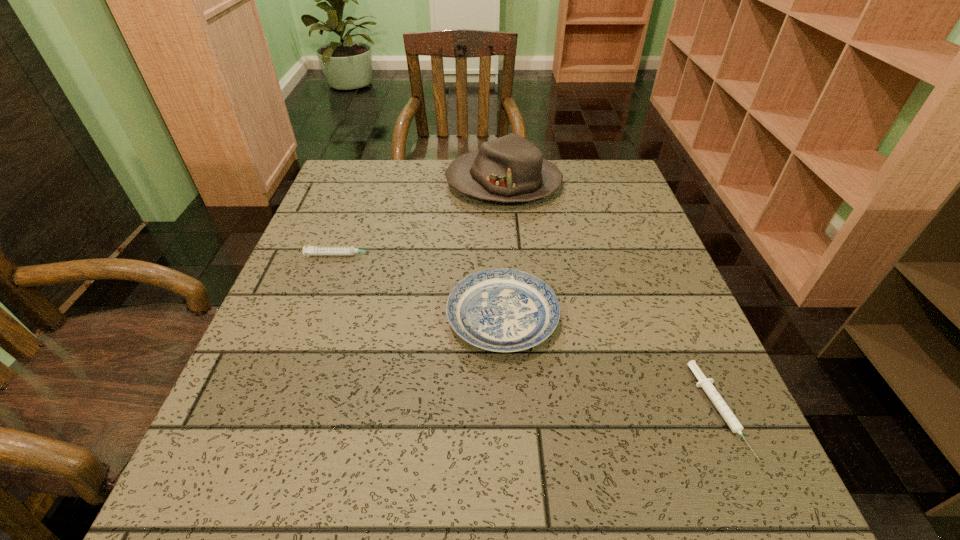
Locate an element on the screen. The image size is (960, 540). the tallest object is located at coordinates (511, 168).

Find the location of `the farthest object`. the farthest object is located at coordinates (511, 168).

Find the location of a particular element. plate is located at coordinates (503, 310).

Locate an element on the screen. The height and width of the screenshot is (540, 960). the third shortest object is located at coordinates (503, 310).

This screenshot has width=960, height=540. Find the location of `the third tallest object`. the third tallest object is located at coordinates [x=309, y=250].

In order to click on the left syringe in this screenshot , I will do `click(309, 250)`.

Where is `the shortest object`? This screenshot has width=960, height=540. the shortest object is located at coordinates (706, 384).

In order to click on the shorter syringe in this screenshot , I will do `click(706, 384)`.

The height and width of the screenshot is (540, 960). What are the coordinates of `free spot located on the decorative side of the hat` in the screenshot? It's located at (417, 184).

Locate an element on the screen. This screenshot has height=540, width=960. vacant space situated 0.110m on the decorative side of the hat is located at coordinates (406, 184).